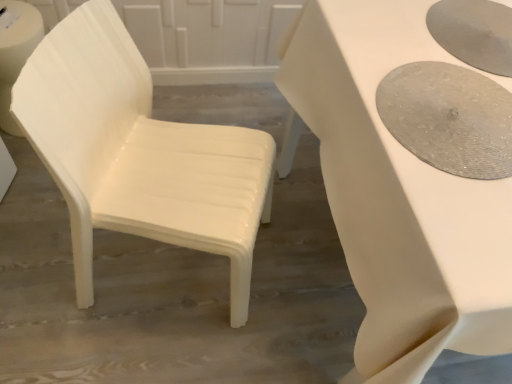
Find the location of a particular element. The image size is (512, 384). free space in front of matte silver tray at right is located at coordinates (456, 218).